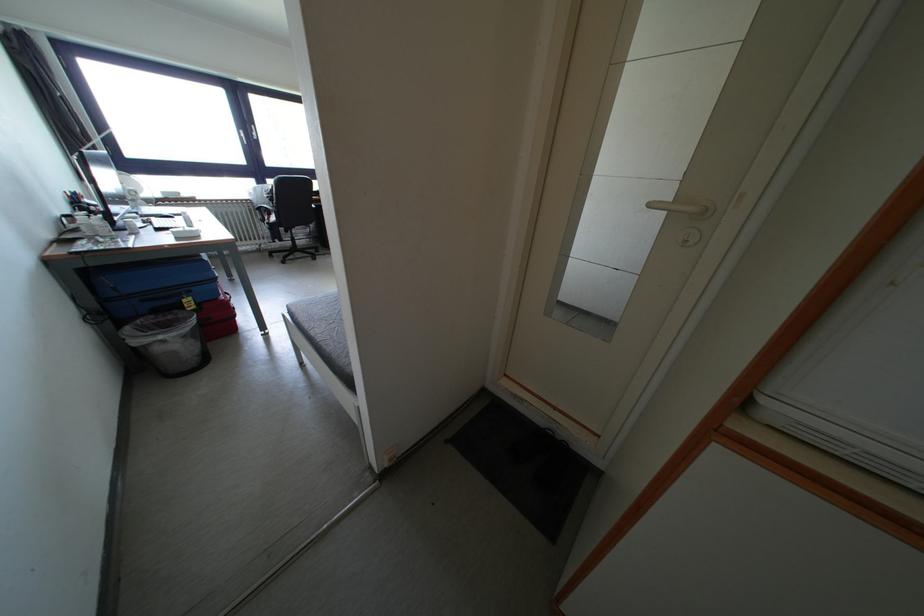
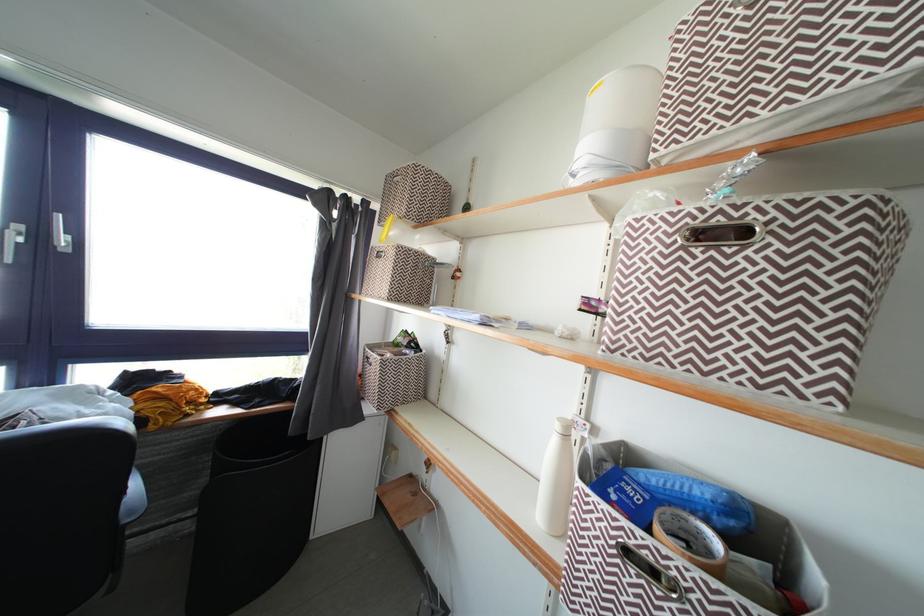
Which direction would the cameraman need to move to produce the second image?

The cameraman walked toward left, forward.